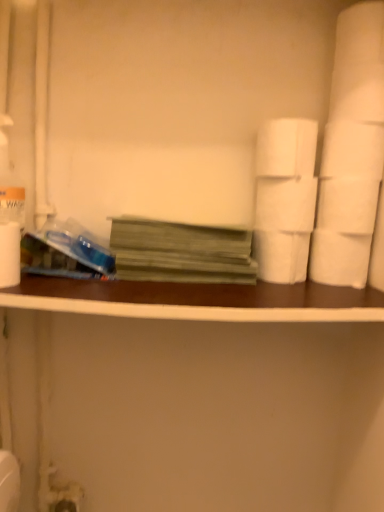
Where is `vacant region above brown wood ledge at center (from a real-world perspective)`? This screenshot has width=384, height=512. vacant region above brown wood ledge at center (from a real-world perspective) is located at coordinates (218, 278).